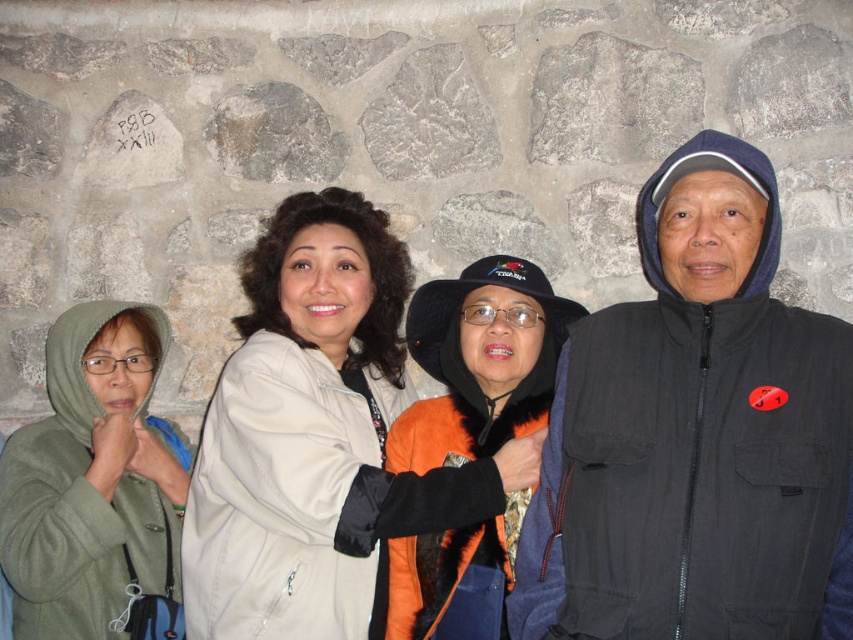
Question: Which of the following is the closest to the observer?

Choices:
 (A) black fabric jacket at right
 (B) green fleece jacket at lower left
 (C) orange fuzzy jacket at center

Answer: (A)

Question: Can you confirm if black fabric jacket at right is positioned below beige fabric coat at center?

Choices:
 (A) no
 (B) yes

Answer: (A)

Question: Where is beige fabric coat at center located in relation to green fleece jacket at lower left in the image?

Choices:
 (A) below
 (B) above

Answer: (B)

Question: Which point is farther to the camera?

Choices:
 (A) green fleece jacket at lower left
 (B) beige fabric coat at center
 (C) orange fuzzy jacket at center

Answer: (C)

Question: Which object is closer to the camera taking this photo?

Choices:
 (A) beige fabric coat at center
 (B) orange fuzzy jacket at center

Answer: (A)

Question: Does beige fabric coat at center have a lesser width compared to orange fuzzy jacket at center?

Choices:
 (A) yes
 (B) no

Answer: (B)